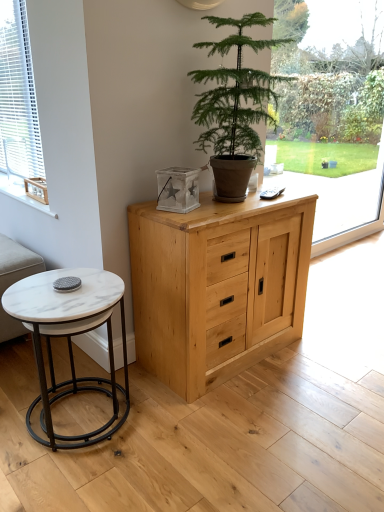
Where is `free location to the right of white marble coffee table at lower left`? This screenshot has width=384, height=512. free location to the right of white marble coffee table at lower left is located at coordinates (172, 432).